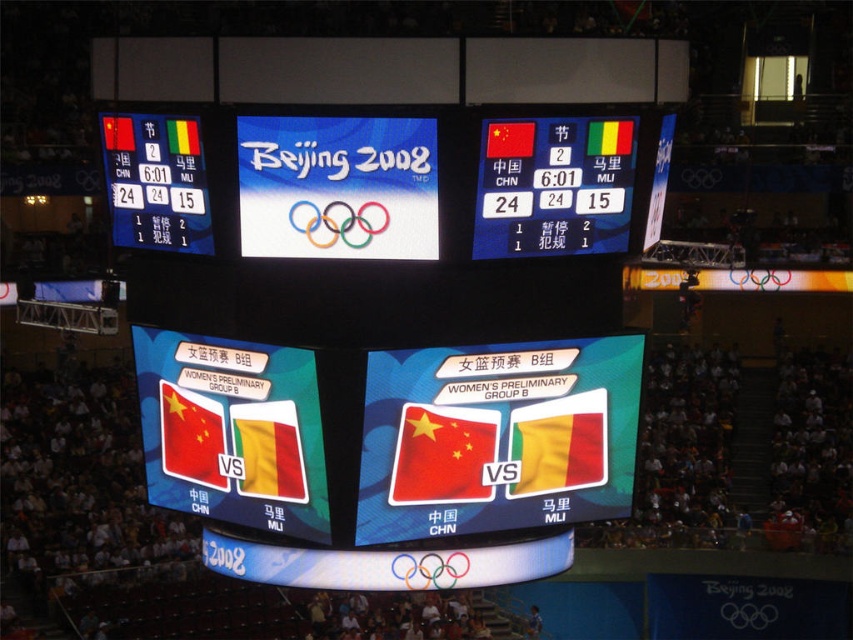
Is matte plastic scoreboard at upper center bigger than white paper at center?

Correct, matte plastic scoreboard at upper center is larger in size than white paper at center.

Which of these two, matte plastic scoreboard at upper center or white paper at center, stands taller?

matte plastic scoreboard at upper center

The height and width of the screenshot is (640, 853). Describe the element at coordinates (480, 172) in the screenshot. I see `matte plastic scoreboard at upper center` at that location.

Locate an element on the screen. The image size is (853, 640). matte plastic scoreboard at upper center is located at coordinates (480, 172).

Between matte plastic scoreboard at upper center and yellow fabric flag at center, which one appears on the left side from the viewer's perspective?

Positioned to the left is matte plastic scoreboard at upper center.

Between point (189, 108) and point (560, 444), which one is positioned behind?

The point (560, 444) is behind.

I want to click on matte plastic scoreboard at upper center, so click(480, 172).

Between white paper at center and red matte flag at lower left, which one is positioned lower?

red matte flag at lower left

The image size is (853, 640). What do you see at coordinates (337, 188) in the screenshot? I see `white paper at center` at bounding box center [337, 188].

Between point (282, 148) and point (171, 464), which one is positioned in front?

Point (282, 148) is more forward.

The width and height of the screenshot is (853, 640). I want to click on white paper at center, so click(337, 188).